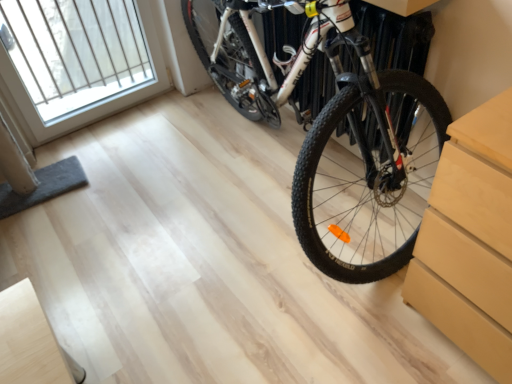
Where is `free space in front of white glass window at upper left`? The height and width of the screenshot is (384, 512). free space in front of white glass window at upper left is located at coordinates (116, 163).